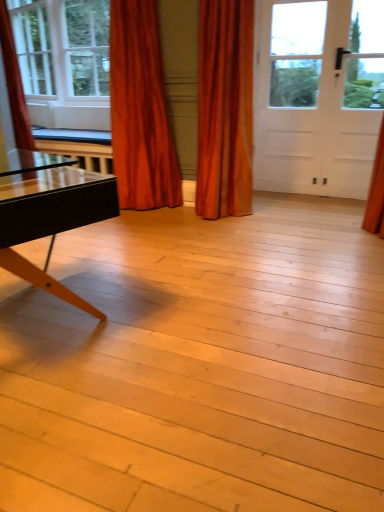
Locate an element on the screen. The height and width of the screenshot is (512, 384). vacant space in front of satin orange curtain at upper left, positioned as the second curtain in right-to-left order is located at coordinates (157, 224).